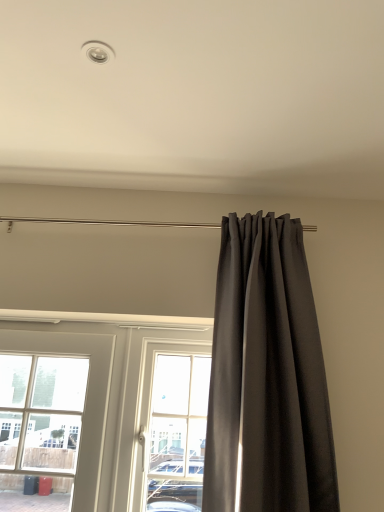
Question: Does dark gray fabric curtain at right appear on the left side of clear glass door at center?

Choices:
 (A) no
 (B) yes

Answer: (A)

Question: From a real-world perspective, is dark gray fabric curtain at right physically above clear glass door at center?

Choices:
 (A) no
 (B) yes

Answer: (B)

Question: Does dark gray fabric curtain at right have a greater height compared to clear glass door at center?

Choices:
 (A) yes
 (B) no

Answer: (A)

Question: From a real-world perspective, is dark gray fabric curtain at right positioned under clear glass door at center based on gravity?

Choices:
 (A) yes
 (B) no

Answer: (B)

Question: Considering the relative sizes of dark gray fabric curtain at right and clear glass door at center in the image provided, is dark gray fabric curtain at right thinner than clear glass door at center?

Choices:
 (A) yes
 (B) no

Answer: (B)

Question: Considering the relative sizes of dark gray fabric curtain at right and clear glass door at center in the image provided, is dark gray fabric curtain at right smaller than clear glass door at center?

Choices:
 (A) no
 (B) yes

Answer: (A)

Question: Can you confirm if clear glass door at center is taller than dark gray fabric curtain at right?

Choices:
 (A) no
 (B) yes

Answer: (A)

Question: Can you confirm if clear glass door at center is thinner than dark gray fabric curtain at right?

Choices:
 (A) no
 (B) yes

Answer: (B)

Question: Is clear glass door at center not near dark gray fabric curtain at right?

Choices:
 (A) no
 (B) yes

Answer: (B)

Question: Is clear glass door at center turned away from dark gray fabric curtain at right?

Choices:
 (A) no
 (B) yes

Answer: (A)

Question: Is clear glass door at center further to camera compared to dark gray fabric curtain at right?

Choices:
 (A) no
 (B) yes

Answer: (B)

Question: From the image's perspective, is clear glass door at center under dark gray fabric curtain at right?

Choices:
 (A) no
 (B) yes

Answer: (B)

Question: Based on their sizes in the image, would you say dark gray fabric curtain at right is bigger or smaller than clear glass door at center?

Choices:
 (A) big
 (B) small

Answer: (A)